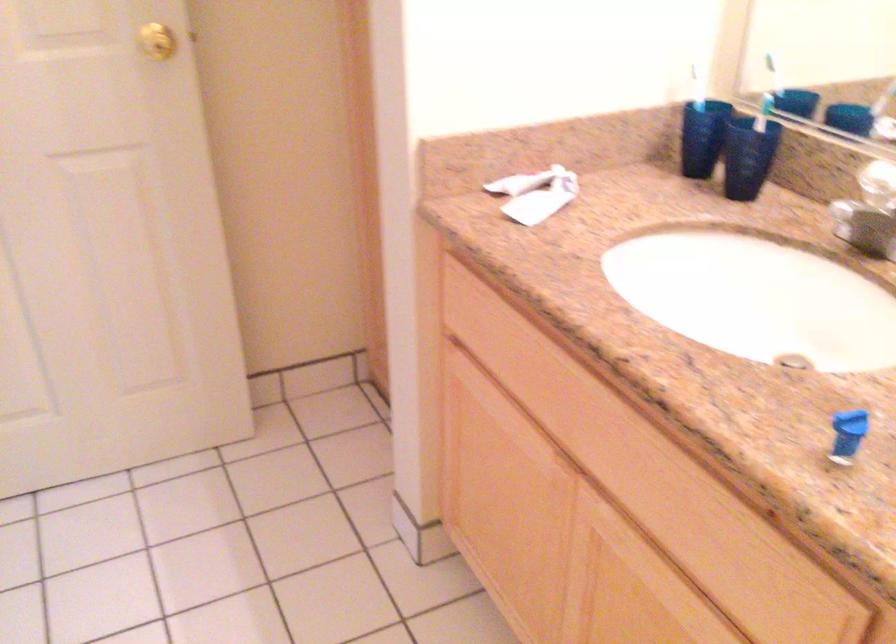
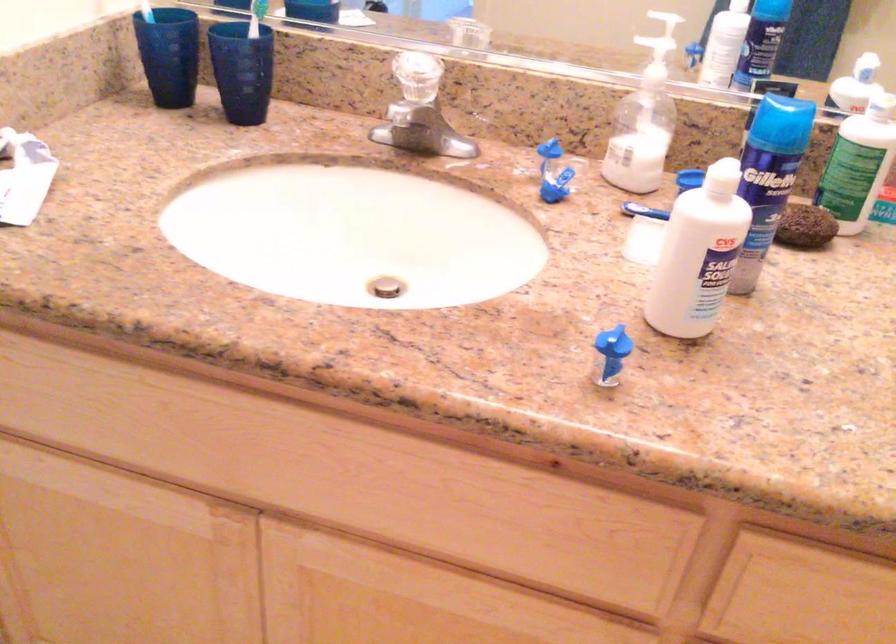
Locate, in the second image, the point that corresponds to point (737, 154) in the first image.

(242, 70)